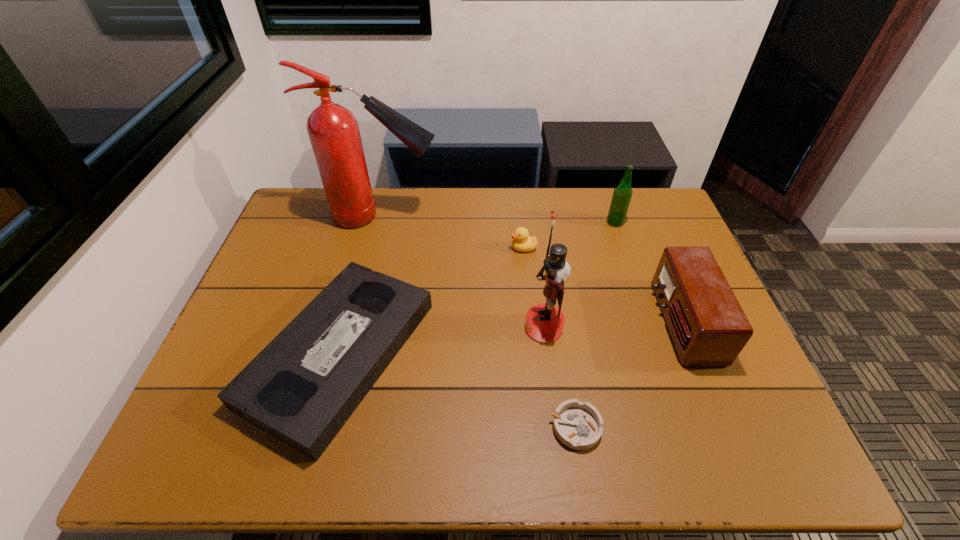
The height and width of the screenshot is (540, 960). Identify the location of object that is at the far left corner. (x=333, y=130).

Where is `object at the near left corner`? The image size is (960, 540). object at the near left corner is located at coordinates (302, 388).

The width and height of the screenshot is (960, 540). In the image, there is a desktop. Identify the location of free region at the far edge. (548, 206).

The height and width of the screenshot is (540, 960). Identify the location of free space at the near edge of the desktop. (534, 450).

In the image, there is a desktop. Identify the location of vacant space at the left edge. The height and width of the screenshot is (540, 960). (320, 238).

In the image, there is a desktop. At what (x,y) coordinates should I click in order to perform the action: click on vacant space at the right edge. Please return your answer as a coordinate pair (x, y). This screenshot has width=960, height=540. Looking at the image, I should click on (643, 253).

The width and height of the screenshot is (960, 540). Find the location of `vacant space at the near left corner of the desktop`. vacant space at the near left corner of the desktop is located at coordinates (x=218, y=438).

In the image, there is a desktop. In order to click on vacant space at the far right corner in this screenshot , I will do point(649,190).

Locate an element on the screen. This screenshot has height=540, width=960. blank region between the ashtray and the fifth shortest object is located at coordinates (595, 325).

Where is `free spot between the fourth shortest object and the beer bottle`? The height and width of the screenshot is (540, 960). free spot between the fourth shortest object and the beer bottle is located at coordinates (649, 272).